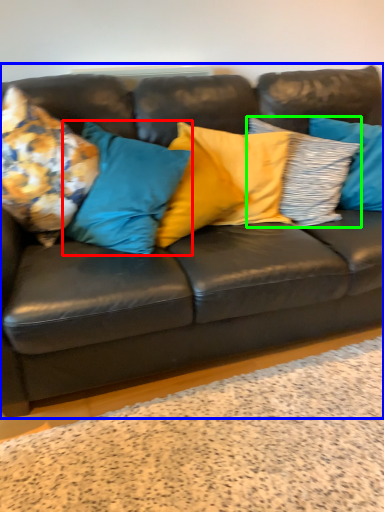
Question: Which object is the closest to the pillow (highlighted by a red box)? Choose among these: studio couch (highlighted by a blue box) or pillow (highlighted by a green box).

Choices:
 (A) studio couch
 (B) pillow

Answer: (A)